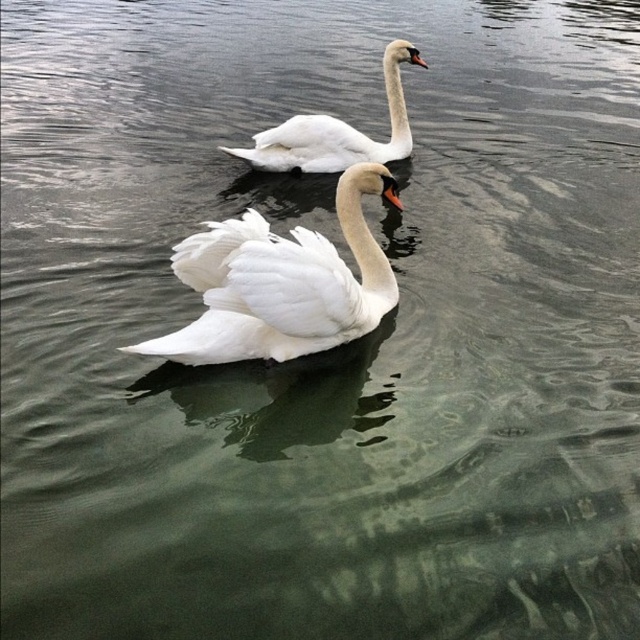
Question: From the image, what is the correct spatial relationship of white feathered swan at center in relation to white glossy swan at upper center?

Choices:
 (A) above
 (B) below

Answer: (B)

Question: Can you confirm if white feathered swan at center is positioned below white glossy swan at upper center?

Choices:
 (A) yes
 (B) no

Answer: (A)

Question: Is white feathered swan at center to the left of white glossy swan at upper center from the viewer's perspective?

Choices:
 (A) yes
 (B) no

Answer: (A)

Question: Which point is farther to the camera?

Choices:
 (A) white feathered swan at center
 (B) white glossy swan at upper center

Answer: (B)

Question: Which object appears closest to the camera in this image?

Choices:
 (A) white glossy swan at upper center
 (B) white feathered swan at center

Answer: (B)